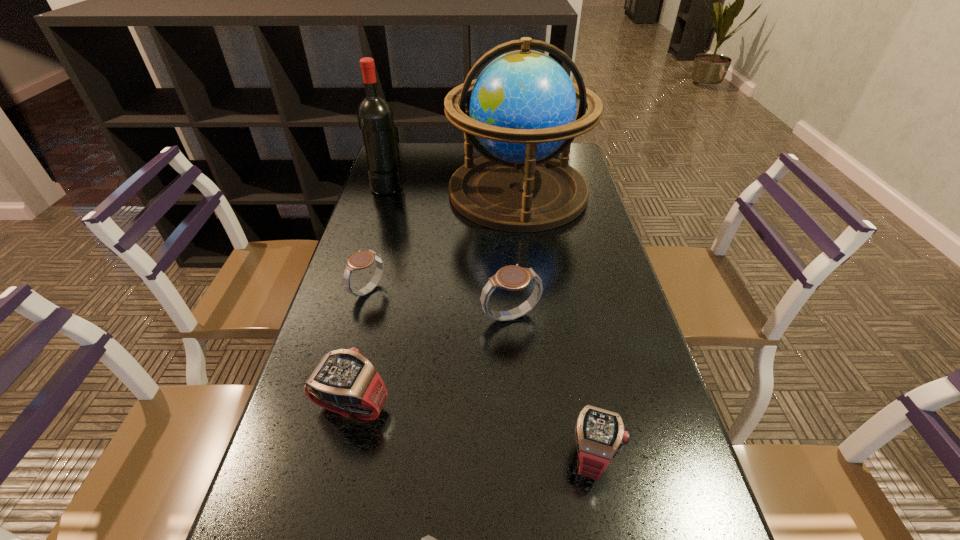
Locate which watch ranks third in proximity to the right red watch. Please provide its 2D coordinates. Your answer should be formatted as a tuple, i.e. [(x, y)], where the tuple contains the x and y coordinates of a point satisfying the conditions above.

[(345, 381)]

Locate an element on the screen. watch that is the fourth closest to the leftmost gray watch is located at coordinates (x=428, y=539).

Identify which gray watch is the closest to the wine bottle. Please provide its 2D coordinates. Your answer should be formatted as a tuple, i.e. [(x, y)], where the tuple contains the x and y coordinates of a point satisfying the conditions above.

[(360, 260)]

Locate which gray watch is the closest to the third watch from right to left. Please provide its 2D coordinates. Your answer should be formatted as a tuple, i.e. [(x, y)], where the tuple contains the x and y coordinates of a point satisfying the conditions above.

[(513, 278)]

Find the location of a particular element. This screenshot has height=540, width=960. red watch that is the second closest to the second smallest gray watch is located at coordinates (600, 434).

Identify which red watch is the nearest to the globe. Please provide its 2D coordinates. Your answer should be formatted as a tuple, i.e. [(x, y)], where the tuple contains the x and y coordinates of a point satisfying the conditions above.

[(345, 381)]

Find the location of a particular element. Image resolution: width=960 pixels, height=540 pixels. free space that satisfies the following two spatial constraints: 1. on the front side of the red wine bottle; 2. on the right side of the left red watch is located at coordinates (321, 406).

Where is `free region that satisfies the following two spatial constraints: 1. on the front side of the smaller red watch; 2. on the left side of the globe`? The width and height of the screenshot is (960, 540). free region that satisfies the following two spatial constraints: 1. on the front side of the smaller red watch; 2. on the left side of the globe is located at coordinates (549, 454).